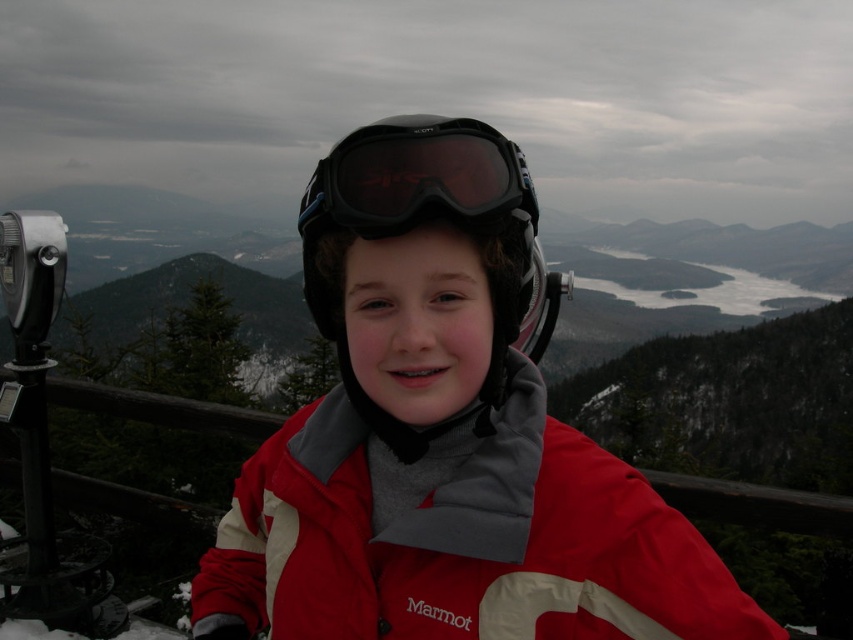
You are a photographer setting up a tripod to take a portrait of the person wearing the matte red jacket at center and the black matte helmet at center. You want to ensure both items are clearly visible in the frame. Based on their sizes, which object should you focus on first to ensure proper framing?

The matte red jacket at center is not as tall as the black matte helmet at center, so you should focus on the black matte helmet at center first to ensure it fits within the frame since it is taller.

You are a photographer trying to capture the scene. You notice the matte red jacket at center and the black matte ski goggles at center. Which object is positioned lower in the image?

The matte red jacket at center is located below the black matte ski goggles at center, so the matte red jacket at center is positioned lower in the image.

You are a drone operator who needs to capture a closeup shot of the matte red jacket at center and the black matte ski goggles at center. The drone has a minimum focus distance of 1 meter. Can the drone focus on both objects simultaneously while maintaining the required distance?

The distance between the matte red jacket at center and black matte ski goggles at center is 1.13 meters. Since the drone requires a minimum focus distance of 1 meter, it can focus on both objects as the distance between them is greater than the required minimum.